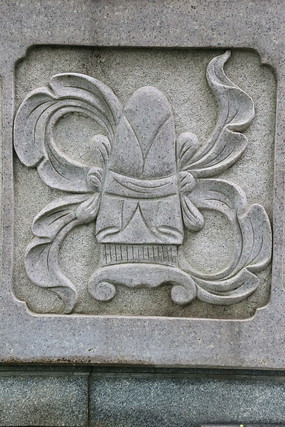
Identify the location of dark marble. (142, 407), (64, 406).